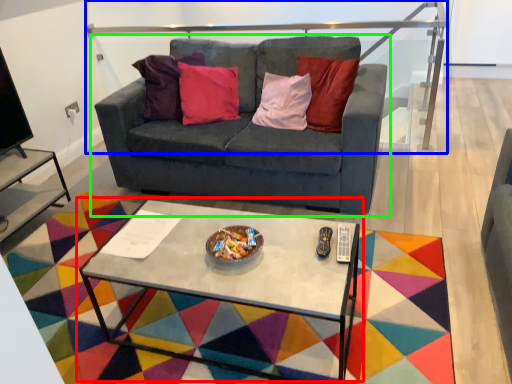
Question: Which object is the closest to the coffee table (highlighted by a red box)? Choose among these: balustrade (highlighted by a blue box) or studio couch (highlighted by a green box).

Choices:
 (A) balustrade
 (B) studio couch

Answer: (B)